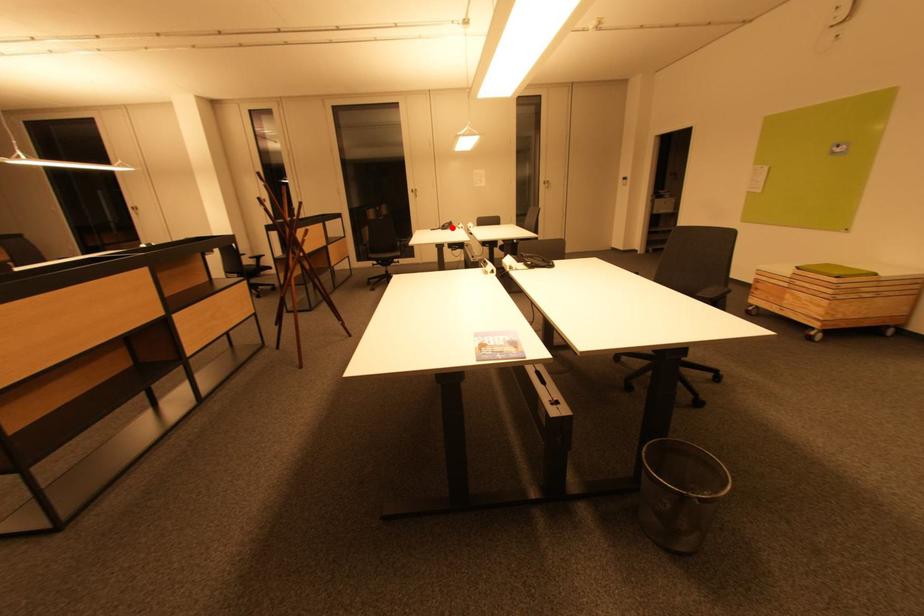
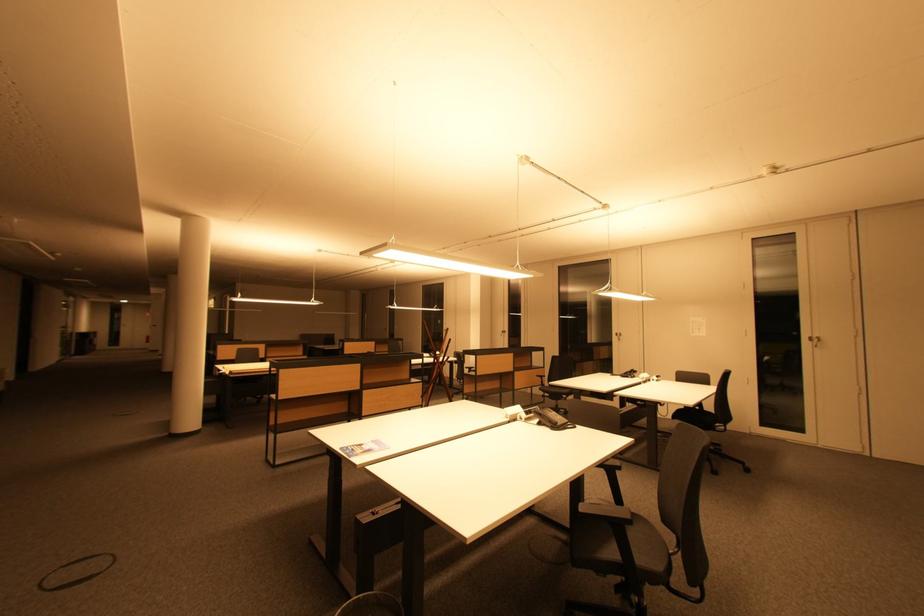
Locate, in the second image, the point that corresponds to the highlighted location in the first image.

(635, 376)